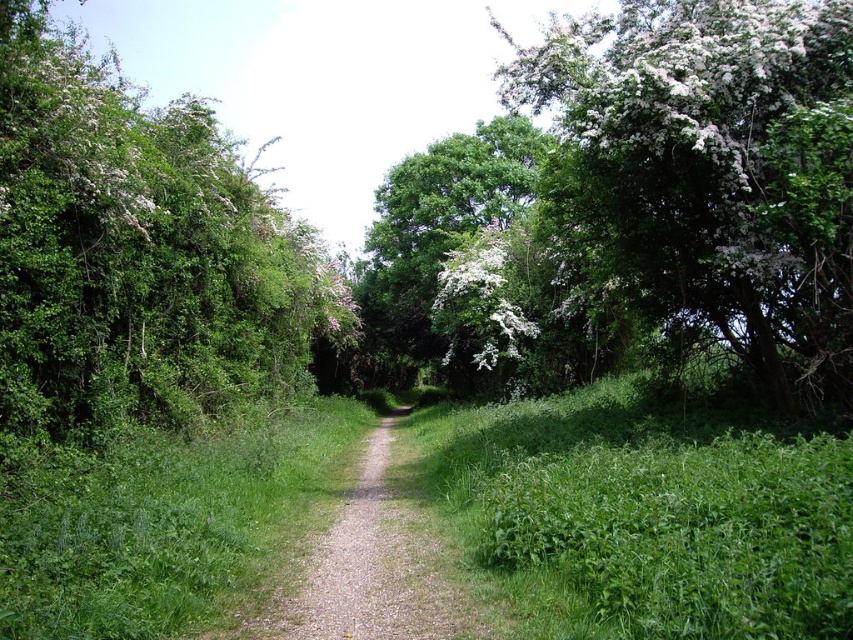
Question: Which object is closer to the camera taking this photo?

Choices:
 (A) green leafy tree at left
 (B) gravel path at center

Answer: (B)

Question: Can you confirm if green leafy tree at left is positioned below gravel path at center?

Choices:
 (A) no
 (B) yes

Answer: (A)

Question: Which object is positioned farthest from the green leafy tree at center?

Choices:
 (A) green leafy tree at left
 (B) gravel path at center

Answer: (B)

Question: Can you confirm if green leafy tree at left is thinner than gravel path at center?

Choices:
 (A) no
 (B) yes

Answer: (A)

Question: Does green leafy tree at left come behind green leafy grass at center?

Choices:
 (A) yes
 (B) no

Answer: (A)

Question: Which point is farther to the camera?

Choices:
 (A) gravel path at center
 (B) green leafy grass at center
 (C) green leafy tree at left

Answer: (C)